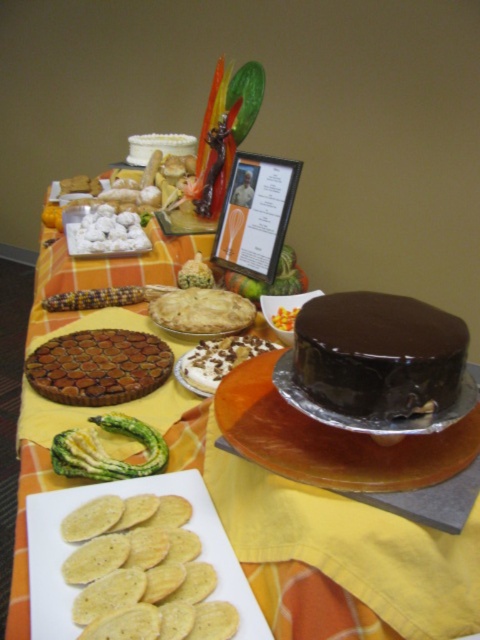
You are planning to serve guests at the festive dessert table. You need to place a large dessert platter that requires 20 inches of space. Which of the two cakes, the chocolatesmoothcake at right or the shiny chocolate cake at center, would you choose to place the platter next to without overlapping?

The shiny chocolate cake at center has a greater width than the chocolatesmoothcake at right. Therefore, placing the platter next to the chocolatesmoothcake at right would require less space and leave enough room for the platter.

You are planning to serve guests at the festive dessert table. You need to choose the bigger cake to cut into slices. Which cake should you choose between the chocolate cake at center and the chocolatesmoothcake at right?

The chocolate cake at center is larger in size than the chocolatesmoothcake at right, so you should choose the chocolate cake at center to cut into slices.